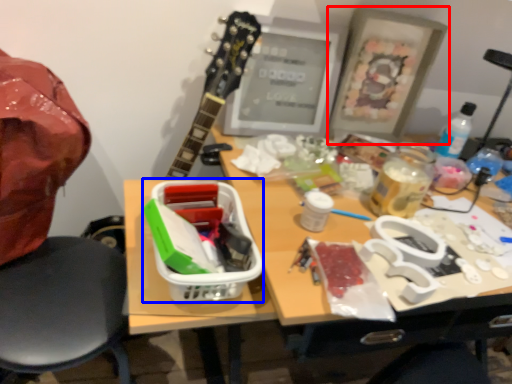
Question: Among these objects, which one is farthest to the camera, picture frame (highlighted by a red box) or lunch box (highlighted by a blue box)?

Choices:
 (A) picture frame
 (B) lunch box

Answer: (A)